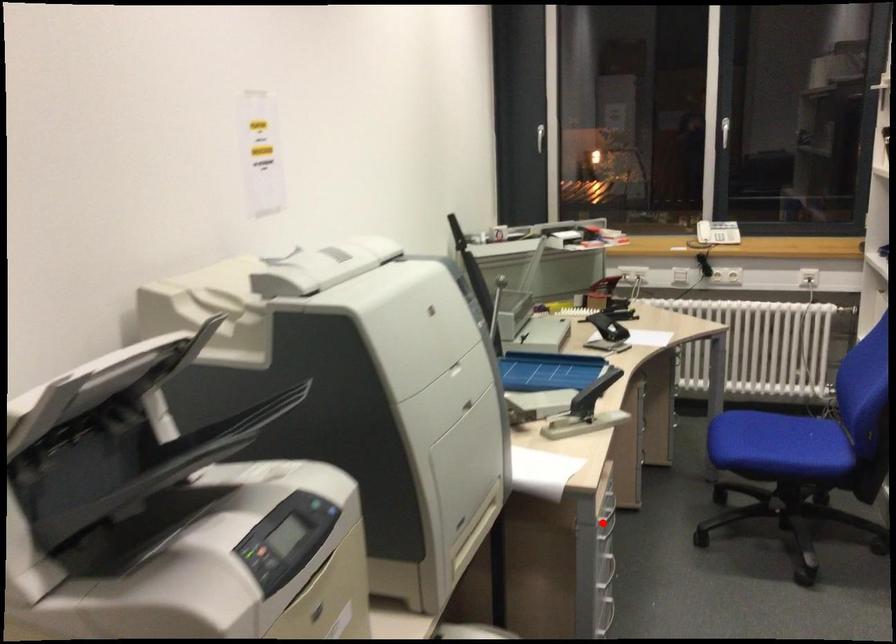
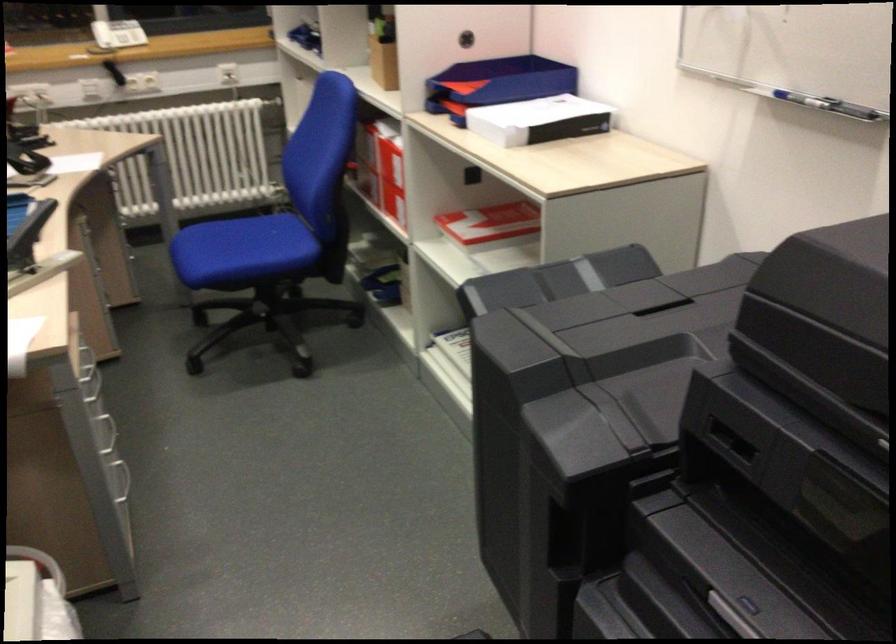
Question: I am providing you with two images of the same scene from different viewpoints. Image1 has a red point marked. In image2, the corresponding 3D location appears at what relative position? Reply with the corresponding letter.

Choices:
 (A) Closer
 (B) Farther

Answer: (A)